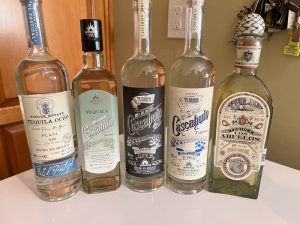
Identify the location of alcohol bottle. This screenshot has height=225, width=300. (33, 83), (86, 84), (135, 76), (185, 74), (244, 89).